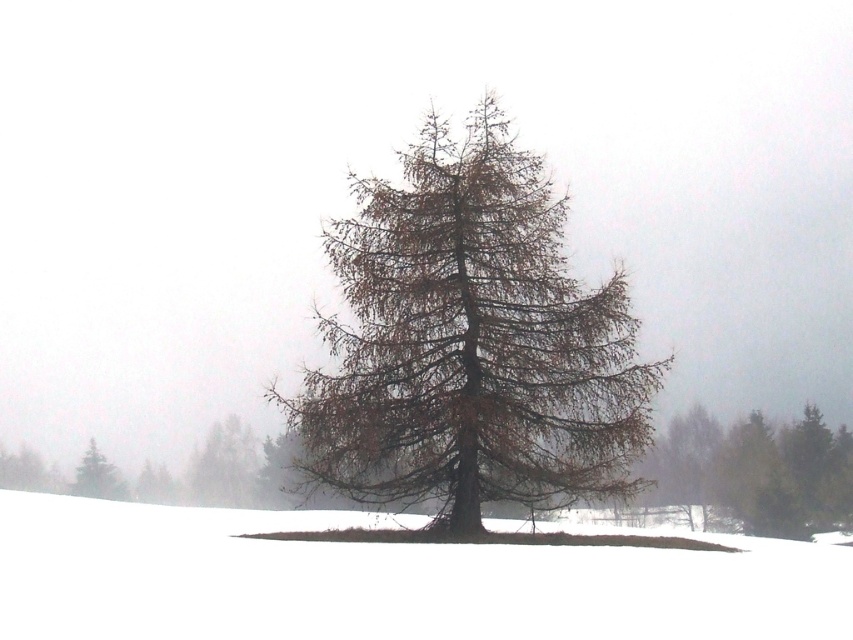
Can you confirm if brown/dried wood tree at center is positioned to the right of green matte tree at lower left?

Yes, brown/dried wood tree at center is to the right of green matte tree at lower left.

Between point (544, 284) and point (119, 477), which one is positioned behind?

Point (119, 477)

The height and width of the screenshot is (640, 853). What are the coordinates of `brown/dried wood tree at center` in the screenshot? It's located at (469, 342).

Who is positioned more to the left, white fluffy snow at center or green matte tree at lower left?

green matte tree at lower left

Who is more forward, (x=815, y=604) or (x=82, y=461)?

Point (x=815, y=604) is more forward.

Locate an element on the screen. This screenshot has height=640, width=853. white fluffy snow at center is located at coordinates (386, 582).

Is brown/dried wood tree at center bigger than white fluffy snow at center?

Incorrect, brown/dried wood tree at center is not larger than white fluffy snow at center.

Between point (444, 176) and point (107, 634), which one is positioned behind?

The point (444, 176) is behind.

Image resolution: width=853 pixels, height=640 pixels. What are the coordinates of `brown/dried wood tree at center` in the screenshot? It's located at (469, 342).